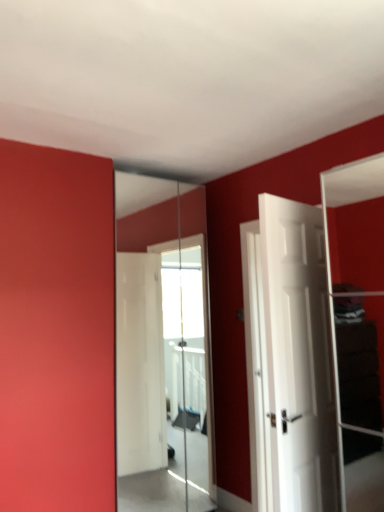
Question: From a real-world perspective, is clear glass mirror at center physically below white matte door at right?

Choices:
 (A) no
 (B) yes

Answer: (A)

Question: Can you confirm if clear glass mirror at center is positioned to the right of white matte door at right?

Choices:
 (A) yes
 (B) no

Answer: (B)

Question: Is clear glass mirror at center looking in the opposite direction of white matte door at right?

Choices:
 (A) no
 (B) yes

Answer: (B)

Question: Can you confirm if clear glass mirror at center is wider than white matte door at right?

Choices:
 (A) yes
 (B) no

Answer: (B)

Question: Considering the relative sizes of clear glass mirror at center and white matte door at right in the image provided, is clear glass mirror at center shorter than white matte door at right?

Choices:
 (A) no
 (B) yes

Answer: (A)

Question: Considering the relative sizes of clear glass mirror at center and white matte door at right in the image provided, is clear glass mirror at center taller than white matte door at right?

Choices:
 (A) no
 (B) yes

Answer: (B)

Question: Is white matte door at right outside clear glass mirror at center?

Choices:
 (A) no
 (B) yes

Answer: (B)

Question: Is white matte door at right smaller than clear glass mirror at center?

Choices:
 (A) no
 (B) yes

Answer: (B)

Question: Does white matte door at right have a greater height compared to clear glass mirror at center?

Choices:
 (A) yes
 (B) no

Answer: (B)

Question: Is white matte door at right bigger than clear glass mirror at center?

Choices:
 (A) yes
 (B) no

Answer: (B)

Question: Is white matte door at right positioned far away from clear glass mirror at center?

Choices:
 (A) no
 (B) yes

Answer: (B)

Question: Does white matte door at right appear on the right side of clear glass mirror at center?

Choices:
 (A) no
 (B) yes

Answer: (B)

Question: Looking at the image, does white matte door at right seem bigger or smaller compared to clear glass mirror at center?

Choices:
 (A) small
 (B) big

Answer: (A)